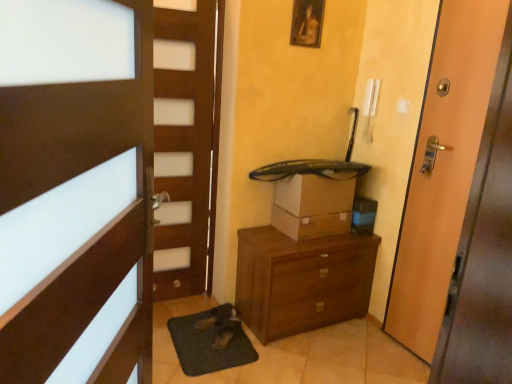
Find the location of `free spot in front of brown wooden chest of drawers at center`. free spot in front of brown wooden chest of drawers at center is located at coordinates (307, 360).